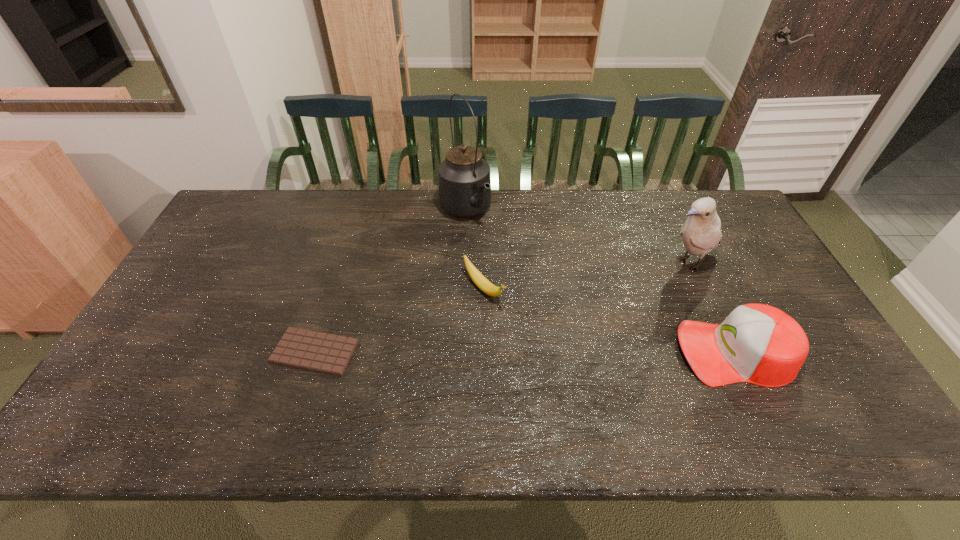
You are a GUI agent. You are given a task and a screenshot of the screen. Output one action in this format:
    pyautogui.click(x=<x>, y=<y>)
    Task: Click on the free space between the second shortest object and the chocolate bar
    This screenshot has width=960, height=540.
    Given the screenshot: What is the action you would take?
    pyautogui.click(x=399, y=320)

Select which object is the second closest to the tallest object. Please provide its 2D coordinates. Your answer should be formatted as a tuple, i.e. [(x, y)], where the tuple contains the x and y coordinates of a point satisfying the conditions above.

[(310, 350)]

Locate which object ranks second in proximity to the fourth shortest object. Please provide its 2D coordinates. Your answer should be formatted as a tuple, i.e. [(x, y)], where the tuple contains the x and y coordinates of a point satisfying the conditions above.

[(482, 283)]